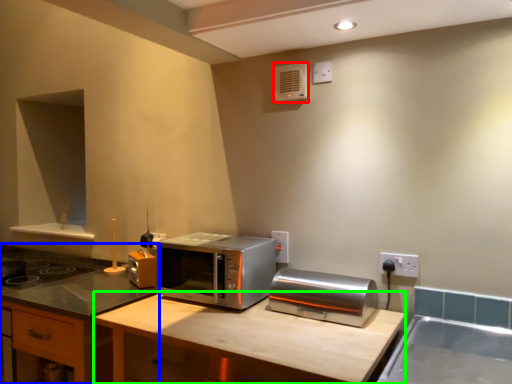
Question: Which object is the closest to the air conditioner (highlighted by a red box)? Choose among these: cabinetry (highlighted by a blue box) or counter top (highlighted by a green box).

Choices:
 (A) cabinetry
 (B) counter top

Answer: (B)